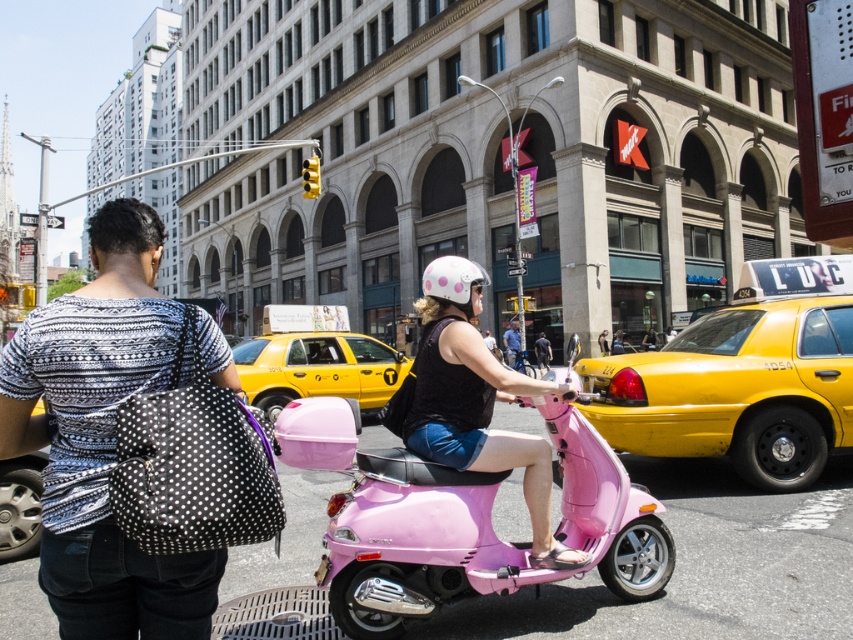
Question: Is black dotted bag at center thinner than yellow rubber taxi at center?

Choices:
 (A) yes
 (B) no

Answer: (A)

Question: Which object appears closest to the camera in this image?

Choices:
 (A) yellow rubber taxi at right
 (B) black smooth shirt at center

Answer: (A)

Question: Which object appears farthest from the camera in this image?

Choices:
 (A) yellow rubber taxi at right
 (B) pink glossy scooter at center
 (C) matte black helmet at center
 (D) yellow rubber taxi at center

Answer: (C)

Question: Which object is positioned closest to the matte black helmet at center?

Choices:
 (A) black dotted bag at center
 (B) pink matte scooter at center
 (C) pink glossy scooter at center
 (D) yellow rubber taxi at right

Answer: (D)

Question: Is pink glossy scooter at center wider than black smooth shirt at center?

Choices:
 (A) no
 (B) yes

Answer: (B)

Question: Does black dotted bag at center come in front of pink matte scooter at center?

Choices:
 (A) yes
 (B) no

Answer: (A)